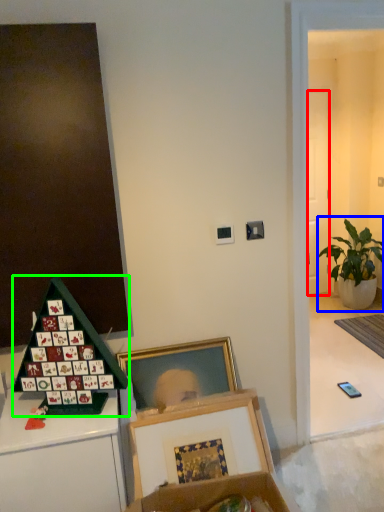
Question: Which object is the closest to the door (highlighted by a red box)? Choose among these: houseplant (highlighted by a blue box) or toy (highlighted by a green box).

Choices:
 (A) houseplant
 (B) toy

Answer: (A)